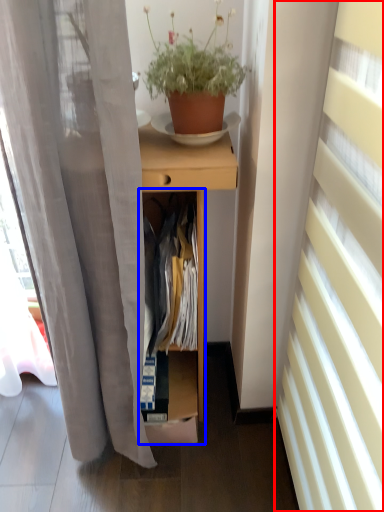
Question: Which point is closer to the camera, curtain (highlighted by a red box) or cabinet (highlighted by a blue box)?

Choices:
 (A) curtain
 (B) cabinet

Answer: (A)